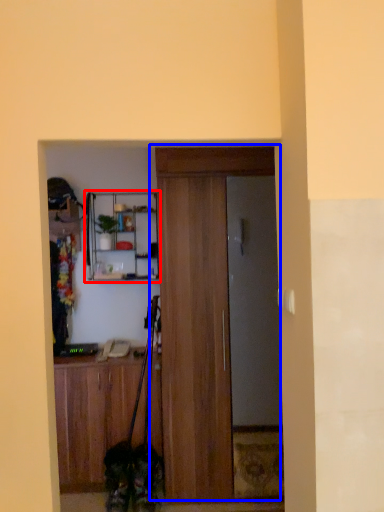
Question: Which object appears closest to the camera in this image, shelf (highlighted by a red box) or door (highlighted by a blue box)?

Choices:
 (A) shelf
 (B) door

Answer: (B)